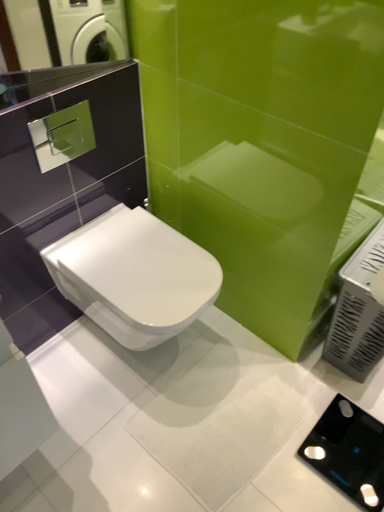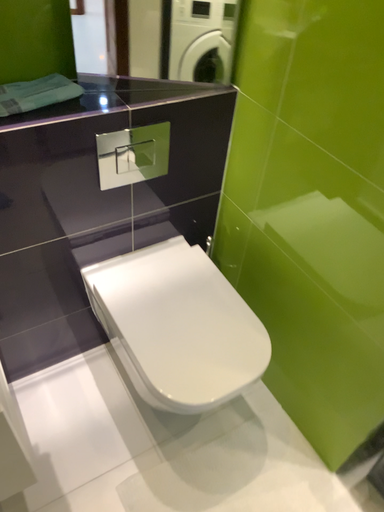
Question: How did the camera likely rotate when shooting the video?

Choices:
 (A) rotated left
 (B) rotated right

Answer: (A)